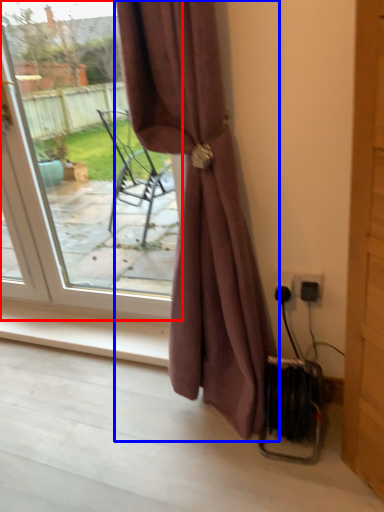
Question: Which of the following is the farthest to the observer, door (highlighted by a red box) or curtain (highlighted by a blue box)?

Choices:
 (A) door
 (B) curtain

Answer: (A)